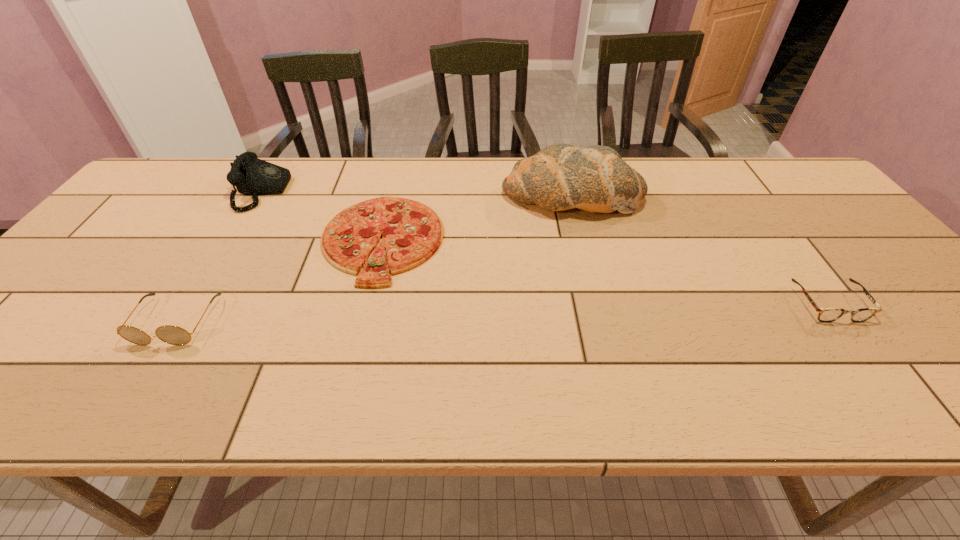
Locate an element on the screen. This screenshot has width=960, height=540. free space that satisfies the following two spatial constraints: 1. on the dial of the fourth shortest object; 2. on the lenses of the sunglasses is located at coordinates (182, 321).

Locate an element on the screen. This screenshot has height=540, width=960. free location that satisfies the following two spatial constraints: 1. on the dial of the telephone; 2. on the back side of the tallest object is located at coordinates (260, 195).

Identify the location of free space in the image that satisfies the following two spatial constraints: 1. on the dial of the telephone; 2. on the left side of the tallest object. (260, 195).

Where is `vacant space that satisfies the following two spatial constraints: 1. on the dial of the telephone; 2. on the back side of the shortest object`? vacant space that satisfies the following two spatial constraints: 1. on the dial of the telephone; 2. on the back side of the shortest object is located at coordinates (232, 240).

I want to click on vacant area in the image that satisfies the following two spatial constraints: 1. on the dial of the fourth shortest object; 2. on the right side of the bread, so click(260, 195).

Image resolution: width=960 pixels, height=540 pixels. I want to click on free region that satisfies the following two spatial constraints: 1. on the dial of the telephone; 2. on the lenses of the sunglasses, so point(182,321).